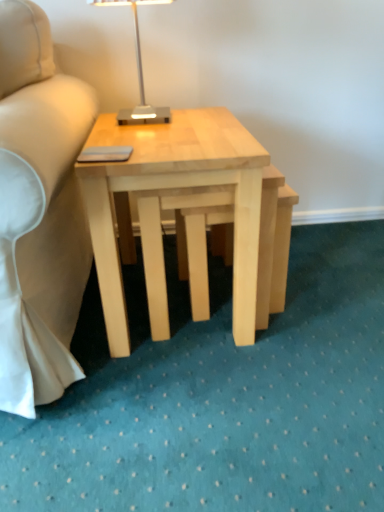
Locate an element on the screen. vacant area that is in front of natural wood step stool at center is located at coordinates (267, 360).